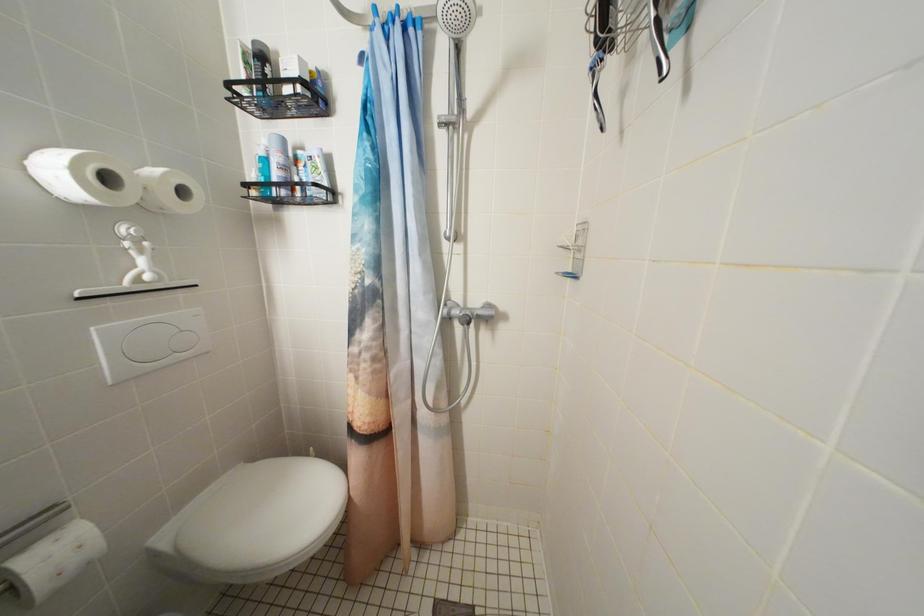
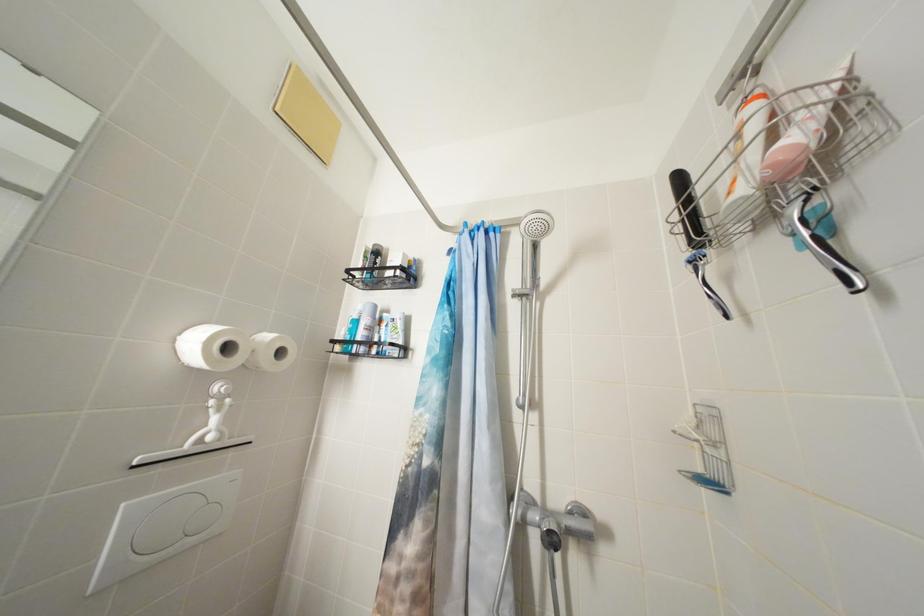
Question: The images are taken continuously from a first-person perspective. In which direction is your viewpoint rotating?

Choices:
 (A) Left
 (B) Right
 (C) Up
 (D) Down

Answer: (C)